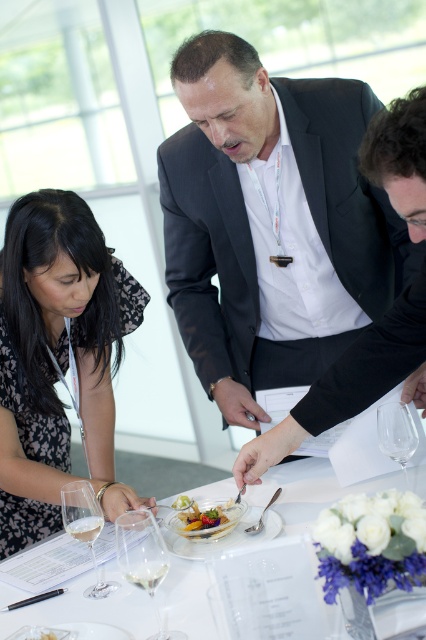
The image size is (426, 640). What are the coordinates of `black dotted dress at lower left` in the screenshot? It's located at (55, 349).

Is black dotted dress at lower left taller than white glossy plate at center?

Yes, black dotted dress at lower left is taller than white glossy plate at center.

From the picture: Who is more forward, (31, 525) or (89, 600)?

Point (89, 600)

Where is `black dotted dress at lower left`? The image size is (426, 640). black dotted dress at lower left is located at coordinates (55, 349).

Is point (0, 528) positioned after point (402, 449)?

Yes.

Does black dotted dress at lower left have a greater width compared to clear glass wine at lower center?

Yes, black dotted dress at lower left is wider than clear glass wine at lower center.

Image resolution: width=426 pixels, height=640 pixels. What do you see at coordinates (55, 349) in the screenshot? I see `black dotted dress at lower left` at bounding box center [55, 349].

Locate an element on the screen. black dotted dress at lower left is located at coordinates (55, 349).

Does clear glass wine glass at center have a smaller size compared to clear glass wine at lower center?

→ No, clear glass wine glass at center is not smaller than clear glass wine at lower center.

Between clear glass wine glass at center and clear glass wine at lower center, which one appears on the left side from the viewer's perspective?

Positioned to the left is clear glass wine glass at center.

Locate an element on the screen. This screenshot has width=426, height=640. clear glass wine glass at center is located at coordinates (143, 557).